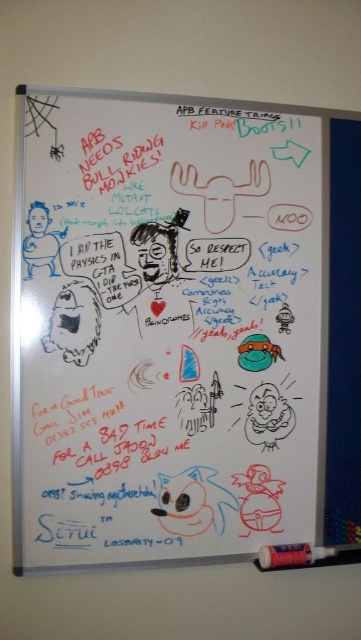
Question: Can you confirm if whiteboard at upper center is smaller than matte plastic crayon at bottom right?

Choices:
 (A) no
 (B) yes

Answer: (A)

Question: Can you confirm if whiteboard at upper center is positioned below matte plastic crayon at bottom right?

Choices:
 (A) no
 (B) yes

Answer: (A)

Question: Is whiteboard at upper center above matte plastic crayon at bottom right?

Choices:
 (A) no
 (B) yes

Answer: (B)